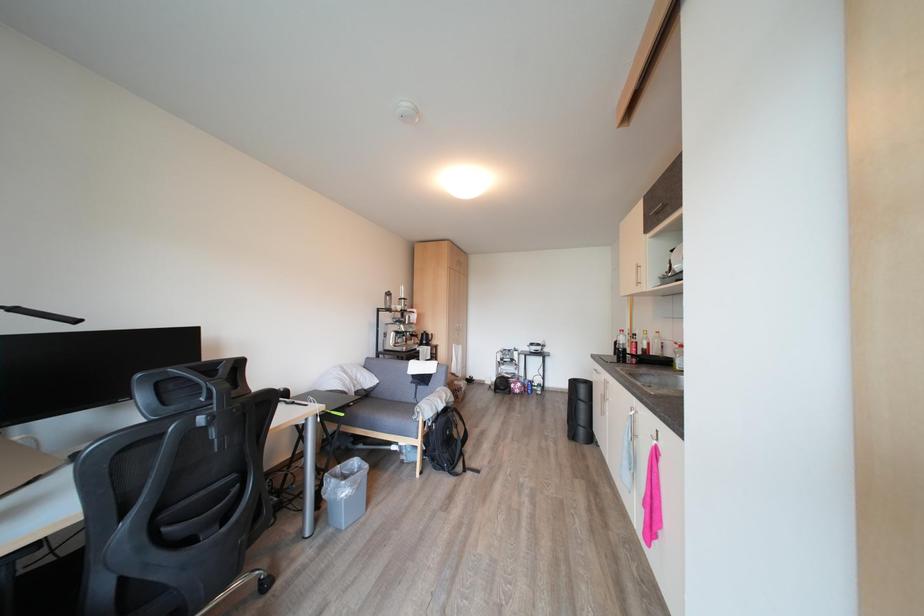
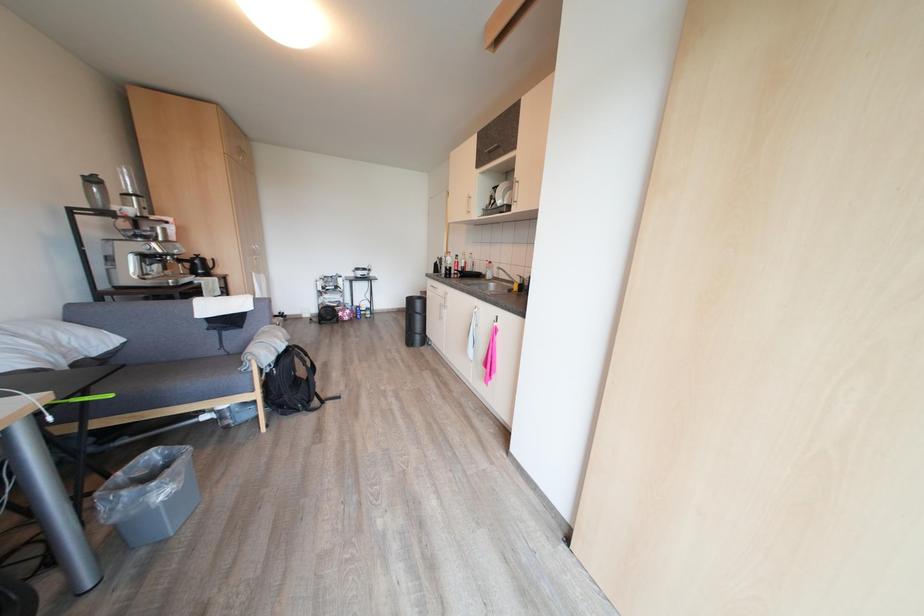
How did the camera likely rotate?

The camera rotated toward right-down.